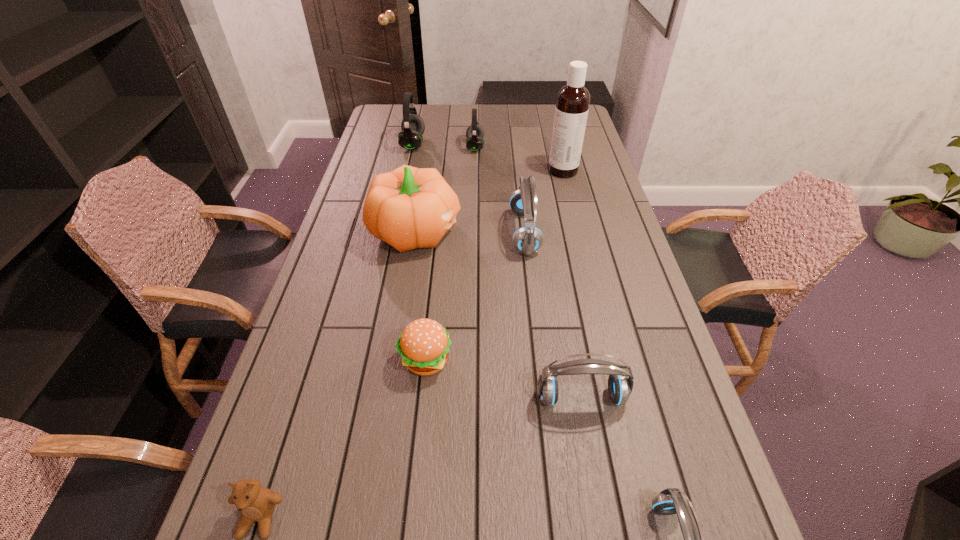
In the image, there is a desktop. Find the location of `vacant space at the far right corner`. vacant space at the far right corner is located at coordinates (550, 112).

Find the location of a particular element. free space between the farthest blue headset and the fourth farthest headset is located at coordinates (553, 315).

This screenshot has width=960, height=540. What are the coordinates of `free space between the hamburger and the dishwasher detergent` in the screenshot? It's located at (494, 265).

Find the location of a particular element. unoccupied area between the pumpkin and the dishwasher detergent is located at coordinates (490, 201).

You are a GUI agent. You are given a task and a screenshot of the screen. Output one action in this format:
    pyautogui.click(x=<x>, y=<y>)
    Task: Click on the vacant point located between the third nearest object and the left black headset
    This screenshot has height=540, width=960.
    Given the screenshot: What is the action you would take?
    pyautogui.click(x=497, y=271)

Image resolution: width=960 pixels, height=540 pixels. I want to click on vacant area that lies between the fourth farthest headset and the fourth nearest object, so click(503, 379).

You are a GUI agent. You are given a task and a screenshot of the screen. Output one action in this format:
    pyautogui.click(x=<x>, y=<y>)
    Task: Click on the empty space that is in between the pumpkin and the second farthest blue headset
    
    Given the screenshot: What is the action you would take?
    pyautogui.click(x=498, y=314)

Where is `vacant space in between the pumpkin and the second nearest blue headset`? The width and height of the screenshot is (960, 540). vacant space in between the pumpkin and the second nearest blue headset is located at coordinates (498, 314).

Identify the location of unoccupied position between the biggest blue headset and the pumpkin. pos(470,232).

Find the location of a particular element. This screenshot has height=540, width=960. the closest object to the fourth headset from right to left is located at coordinates (410, 138).